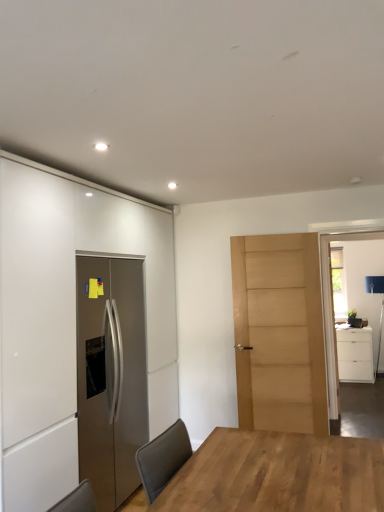
Question: Is light brown wooden table at center touching light brown wood door at center?

Choices:
 (A) no
 (B) yes

Answer: (A)

Question: Considering the relative positions of light brown wooden table at center and light brown wood door at center in the image provided, is light brown wooden table at center to the right of light brown wood door at center from the viewer's perspective?

Choices:
 (A) no
 (B) yes

Answer: (A)

Question: From the image's perspective, is light brown wooden table at center under light brown wood door at center?

Choices:
 (A) yes
 (B) no

Answer: (A)

Question: Is light brown wooden table at center thinner than light brown wood door at center?

Choices:
 (A) no
 (B) yes

Answer: (A)

Question: Is light brown wooden table at center positioned behind light brown wood door at center?

Choices:
 (A) no
 (B) yes

Answer: (A)

Question: Is the depth of light brown wooden table at center less than that of light brown wood door at center?

Choices:
 (A) no
 (B) yes

Answer: (B)

Question: Can you confirm if white matte cabinet at left, which is the 1th cabinetry in front-to-back order, is thinner than white matte cabinet at right, acting as the 1th cabinetry starting from the right?

Choices:
 (A) yes
 (B) no

Answer: (A)

Question: Is white matte cabinet at left, which is the 1th cabinetry in front-to-back order, facing away from white matte cabinet at right, acting as the 1th cabinetry starting from the right?

Choices:
 (A) yes
 (B) no

Answer: (B)

Question: Is the depth of white matte cabinet at left, the second cabinetry viewed from the back, less than that of white matte cabinet at right, acting as the 2th cabinetry starting from the left?

Choices:
 (A) no
 (B) yes

Answer: (B)

Question: Is white matte cabinet at left, the 2th cabinetry in the right-to-left sequence, bigger than white matte cabinet at right, the first cabinetry from the back?

Choices:
 (A) no
 (B) yes

Answer: (B)

Question: Is white matte cabinet at right, acting as the 1th cabinetry starting from the right, inside white matte cabinet at left, which is the 1th cabinetry in front-to-back order?

Choices:
 (A) no
 (B) yes

Answer: (A)

Question: Does white matte cabinet at left, acting as the 1th cabinetry starting from the left, appear on the right side of white matte cabinet at right, the 2th cabinetry viewed from the front?

Choices:
 (A) no
 (B) yes

Answer: (A)

Question: Considering the relative sizes of light brown wooden table at center and clear glass door at right in the image provided, is light brown wooden table at center shorter than clear glass door at right?

Choices:
 (A) yes
 (B) no

Answer: (A)